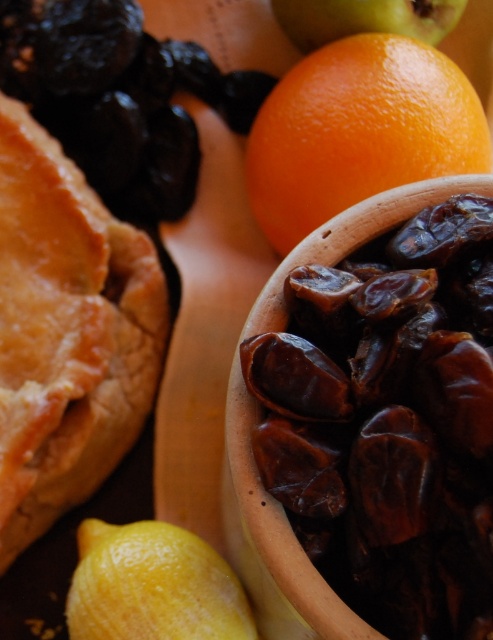
Question: Does brown matte dates at center right have a greater width compared to smooth orange at upper center?

Choices:
 (A) no
 (B) yes

Answer: (B)

Question: Does brown matte dates at center right have a lesser width compared to yellow matte lemon at lower left?

Choices:
 (A) no
 (B) yes

Answer: (A)

Question: Which point is farther to the camera?

Choices:
 (A) (452, 528)
 (B) (449, 125)

Answer: (B)

Question: Does orange matte at upper right lie behind yellow matte lemon at lower left?

Choices:
 (A) yes
 (B) no

Answer: (A)

Question: Which point is farther to the camera?

Choices:
 (A) yellow matte lemon at lower left
 (B) orange matte at upper right

Answer: (B)

Question: Which object is farther from the camera taking this photo?

Choices:
 (A) orange matte at upper right
 (B) brown matte dates at center right

Answer: (A)